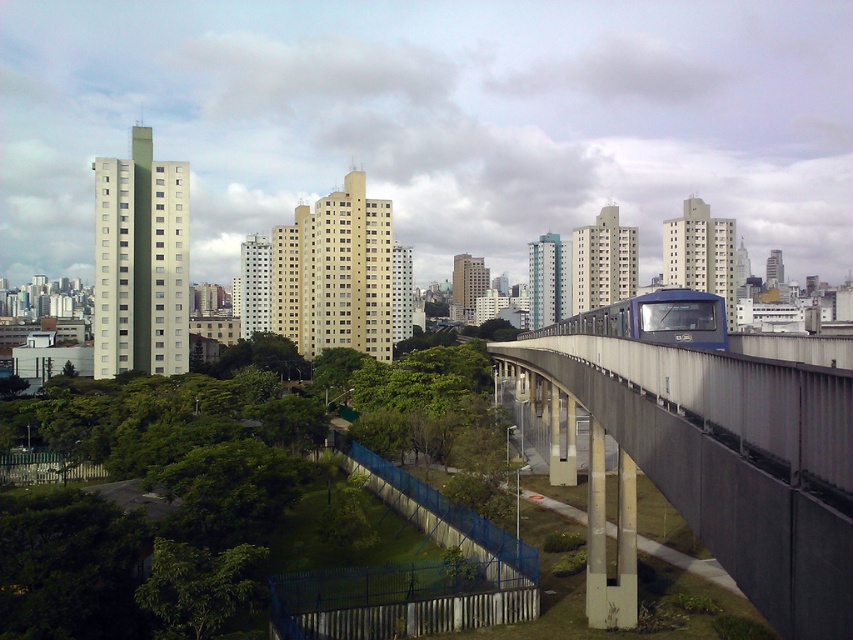
You are a city planner analyzing the urban layout. Based on the scene, which object is closer to the viewer between the concrete bridge at right and the blue metallic train at center?

The concrete bridge at right is closer to the viewer since it is positioned in front of the blue metallic train at center.

You are a city planner analyzing the urban layout. Given the image, can you determine if the blue metallic train at center is currently passing over the concrete bridge at right?

The concrete bridge at right is positioned under the blue metallic train at center, so yes, the blue metallic train at center is currently passing over the concrete bridge at right.

You are a city planner assessing the urban layout. The green leafy tree at center and the concrete bridge at right are both in the park area. Based on their heights, which one is more likely to block sunlight to the grass below?

The green leafy tree at center is taller than the concrete bridge at right, so it is more likely to block sunlight to the grass below.